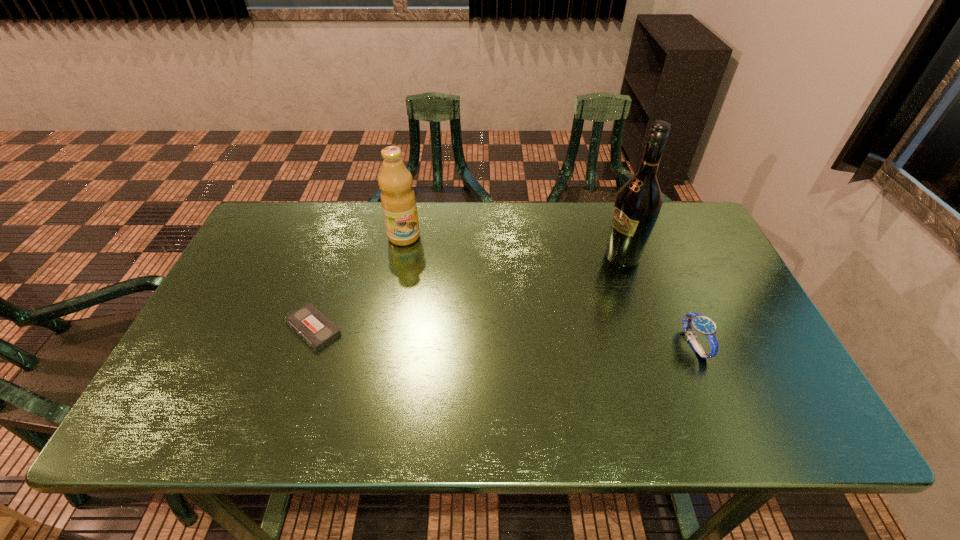
Image resolution: width=960 pixels, height=540 pixels. I want to click on videotape, so click(x=309, y=323).

Find the location of `the leftmost object`. the leftmost object is located at coordinates (309, 323).

What are the coordinates of `the rightmost object` in the screenshot? It's located at tap(704, 326).

Locate an element on the screen. watch is located at coordinates (704, 326).

Where is `wine bottle`? The width and height of the screenshot is (960, 540). wine bottle is located at coordinates (638, 202).

In order to click on the third object from left to right in this screenshot , I will do `click(638, 202)`.

I want to click on the second object from left to right, so click(x=395, y=181).

Where is `olive oil`? The image size is (960, 540). olive oil is located at coordinates (395, 181).

The image size is (960, 540). I want to click on vacant region located 0.150m on the right of the shortest object, so click(402, 328).

This screenshot has width=960, height=540. What are the coordinates of `vacant space situated on the back of the watch` in the screenshot? It's located at (654, 247).